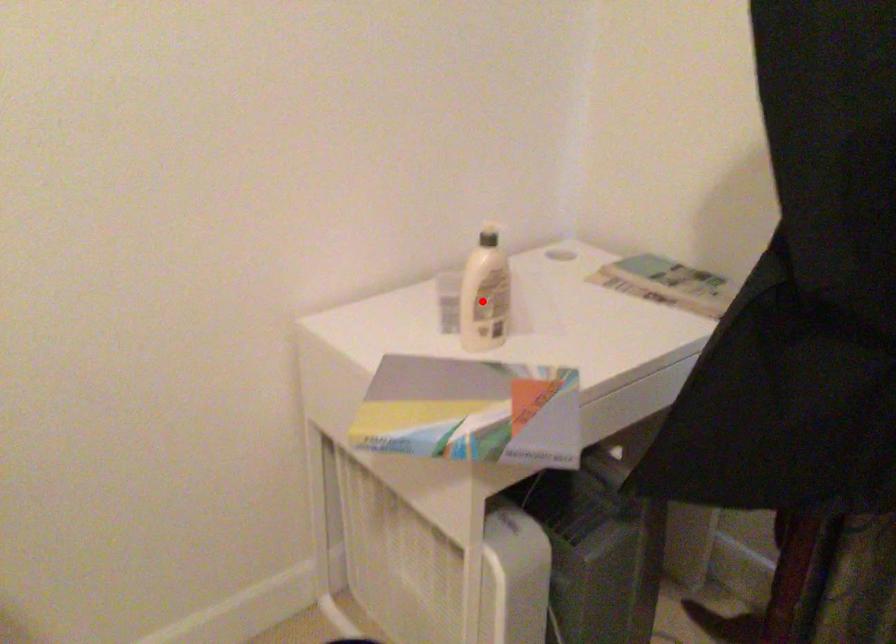
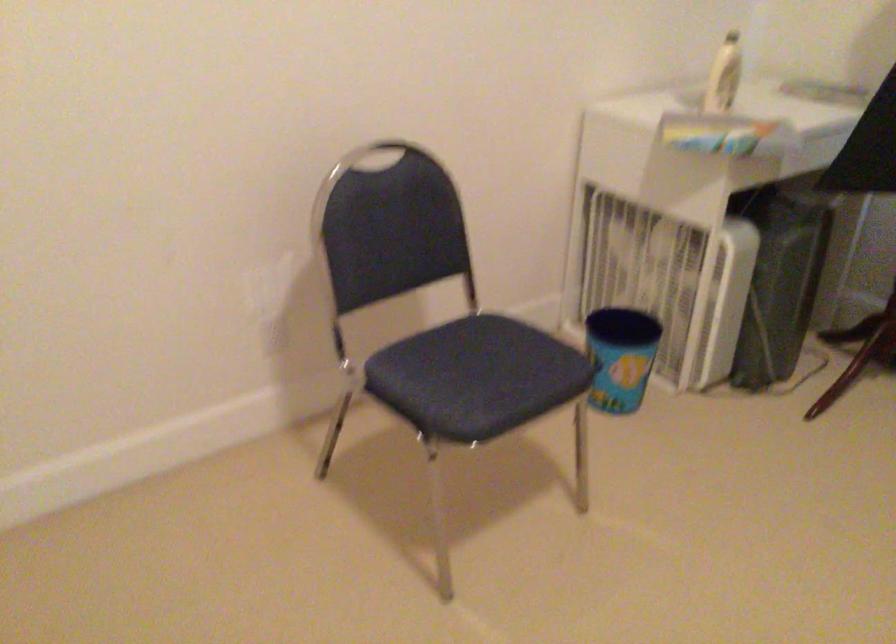
Question: I am providing you with two images of the same scene from different viewpoints. A red point is shown in image1. For the corresponding object point in image2, is it positioned nearer or farther from the camera?

Choices:
 (A) Nearer
 (B) Farther

Answer: (B)